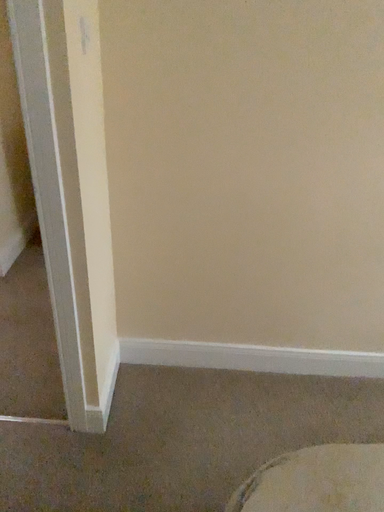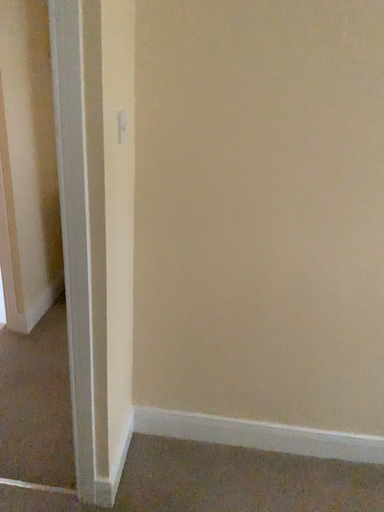
Question: How did the camera likely rotate when shooting the video?

Choices:
 (A) rotated downward
 (B) rotated upward

Answer: (B)